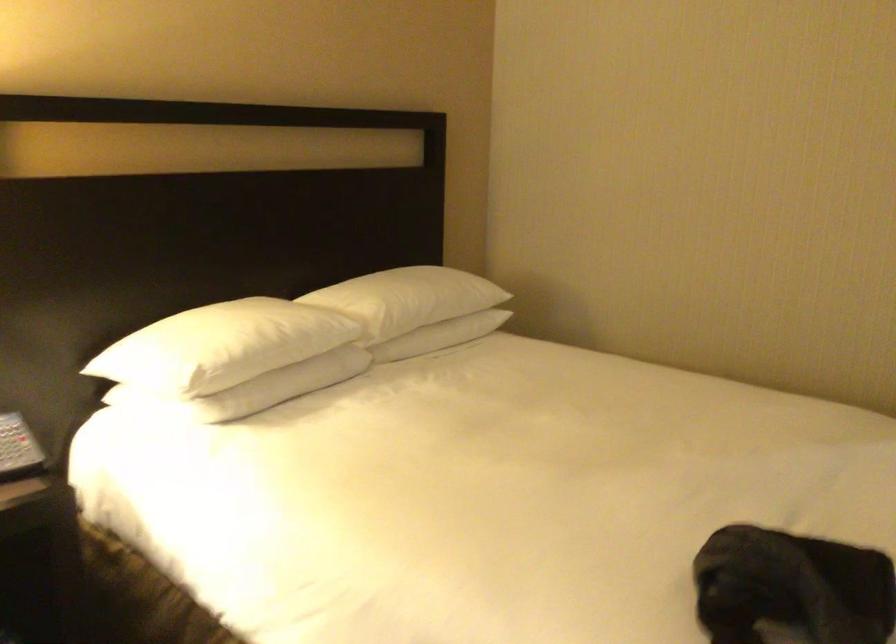
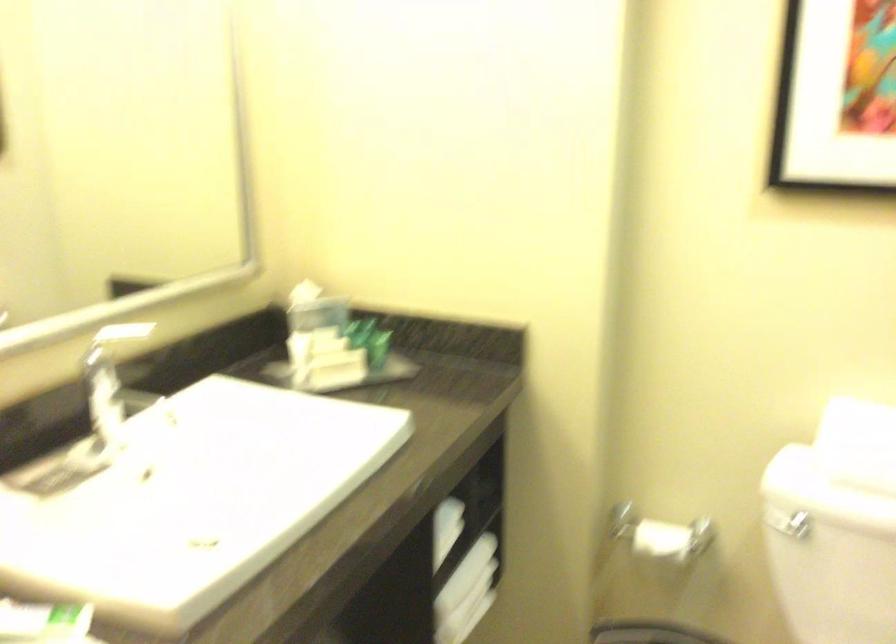
Question: I am providing you with two images of the same scene from different viewpoints. Please identify which objects are invisible in image2.

Choices:
 (A) folded white towel
 (B) silver faucet handle
 (C) brown teddy bear
 (D) white pillow

Answer: (D)